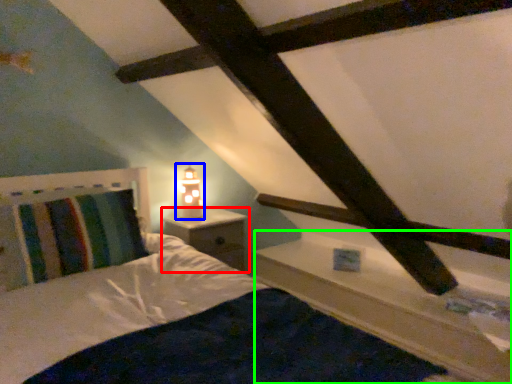
Question: Which object is positioned closest to nightstand (highlighted by a red box)? Select from table lamp (highlighted by a blue box) and ledge (highlighted by a green box).

Choices:
 (A) table lamp
 (B) ledge

Answer: (A)